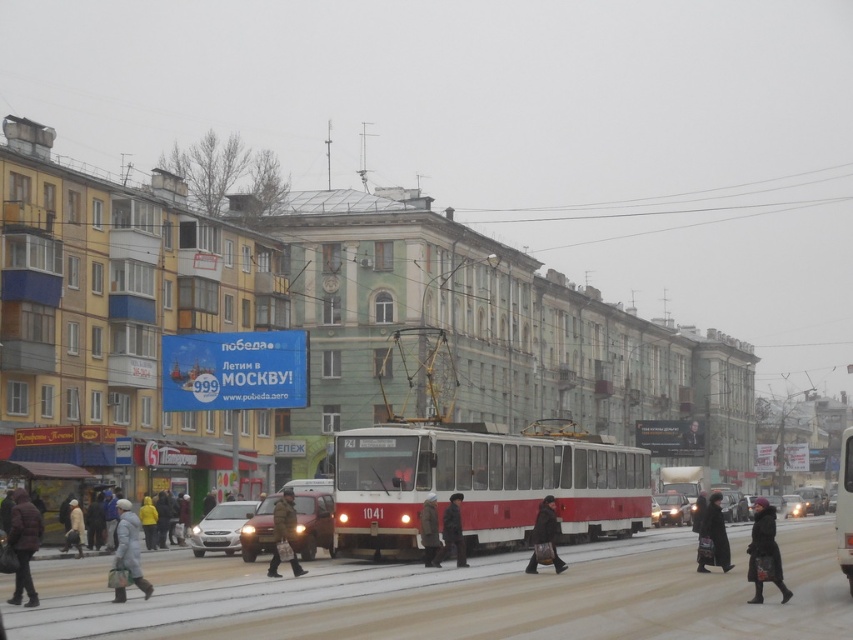
You are a delivery person standing at the tram station and need to deliver a package to someone wearing a dark gray wool coat at lower right and another to someone wearing a dark brown fur coat at center. The delivery robot you have can carry both packages but can only travel 7 meters before needing a recharge. Can the robot deliver both packages without needing to recharge?

The dark gray wool coat at lower right and dark brown fur coat at center are 7.48 meters apart from each other. Since the robot can only travel 7 meters before needing a recharge, it cannot deliver both packages without recharging, as the distance between the two delivery points exceeds its travel limit.

You are standing at the point labeled as point (764, 552) in the image. What object are you currently standing on?

The point (764, 552) is on the dark gray wool coat at lower right.

You are a photographer standing in the middle of the snowy street, and you want to take a picture of both the brown fuzzy coat at lower left and the yellow matte jacket at lower left. Which object should you focus on first if you want to capture both in the same frame without moving the camera?

The brown fuzzy coat at lower left is much taller than the yellow matte jacket at lower left, so you should focus on the brown fuzzy coat at lower left first to ensure both are in frame.